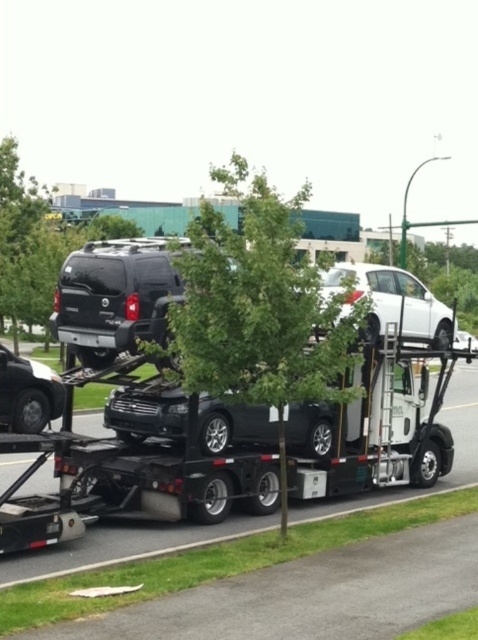
Does glossy black car carrier at center have a smaller size compared to green leafy tree at upper left?

Yes, glossy black car carrier at center is smaller than green leafy tree at upper left.

The image size is (478, 640). What do you see at coordinates (273, 452) in the screenshot?
I see `glossy black car carrier at center` at bounding box center [273, 452].

Describe the element at coordinates (273, 452) in the screenshot. I see `glossy black car carrier at center` at that location.

Image resolution: width=478 pixels, height=640 pixels. In order to click on glossy black car carrier at center in this screenshot , I will do (273, 452).

Describe the element at coordinates (260, 310) in the screenshot. Image resolution: width=478 pixels, height=640 pixels. I see `green leafy tree at center` at that location.

The height and width of the screenshot is (640, 478). Find the location of `green leafy tree at center`. green leafy tree at center is located at coordinates (260, 310).

Identify the location of green leafy tree at center. The width and height of the screenshot is (478, 640). (260, 310).

Looking at this image, which is more to the left, green leafy tree at center or green leafy tree at upper left?

From the viewer's perspective, green leafy tree at upper left appears more on the left side.

Does green leafy tree at center have a larger size compared to green leafy tree at upper left?

Incorrect, green leafy tree at center is not larger than green leafy tree at upper left.

Is point (184, 326) farther from viewer compared to point (29, 209)?

No.

At what (x,y) coordinates should I click in order to perform the action: click on green leafy tree at center. Please return your answer as a coordinate pair (x, y). This screenshot has width=478, height=640. Looking at the image, I should click on (260, 310).